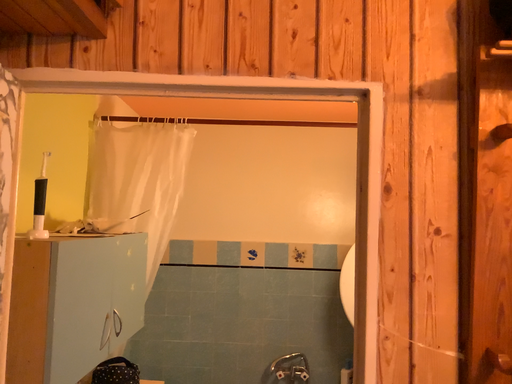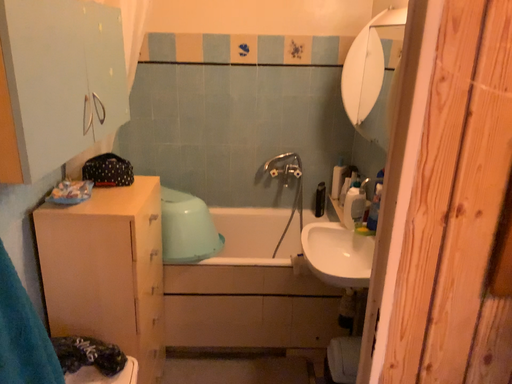
Question: Which way did the camera rotate in the video?

Choices:
 (A) rotated downward
 (B) rotated upward

Answer: (A)